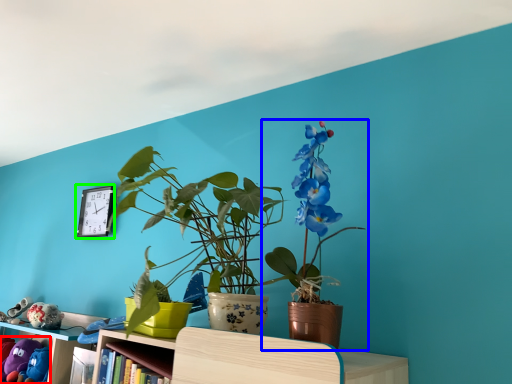
Question: Which is nearer to the toy (highlighted by a red box)? houseplant (highlighted by a blue box) or clock (highlighted by a green box).

Choices:
 (A) houseplant
 (B) clock

Answer: (B)